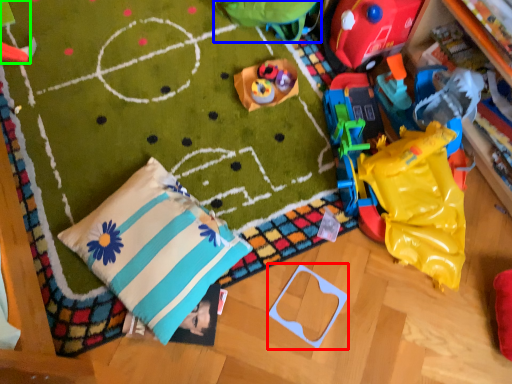
Question: Which object is the farthest from toy (highlighted by a red box)? Choose among these: toy (highlighted by a blue box) or toy (highlighted by a green box).

Choices:
 (A) toy
 (B) toy

Answer: (B)